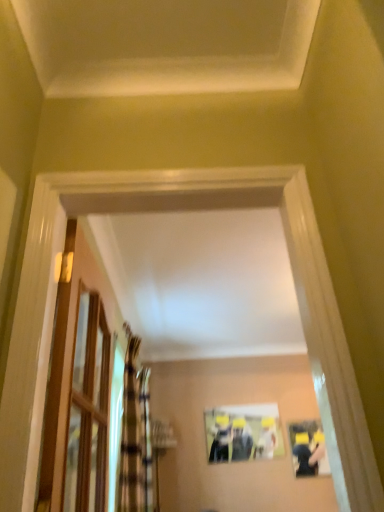
Question: Is plaid fabric curtain at left, the 1th curtain from the back, further to camera compared to gold textured curtain at left, which is the 1th curtain from front to back?

Choices:
 (A) no
 (B) yes

Answer: (B)

Question: Can you confirm if plaid fabric curtain at left, which is the 2th curtain from front to back, is thinner than gold textured curtain at left, arranged as the second curtain when viewed from the back?

Choices:
 (A) yes
 (B) no

Answer: (B)

Question: From the image's perspective, is plaid fabric curtain at left, which is the 2th curtain from front to back, beneath gold textured curtain at left, which is the 1th curtain from front to back?

Choices:
 (A) yes
 (B) no

Answer: (A)

Question: Does plaid fabric curtain at left, which is the 2th curtain from front to back, appear on the left side of gold textured curtain at left, which is the 1th curtain from front to back?

Choices:
 (A) no
 (B) yes

Answer: (B)

Question: Does plaid fabric curtain at left, the 1th curtain from the back, have a greater height compared to gold textured curtain at left, which is the 1th curtain from front to back?

Choices:
 (A) yes
 (B) no

Answer: (A)

Question: From a real-world perspective, relative to matte black couple at center, is clear glass door at left vertically above or below?

Choices:
 (A) above
 (B) below

Answer: (A)

Question: Do you think clear glass door at left is within matte black couple at center, or outside of it?

Choices:
 (A) inside
 (B) outside

Answer: (B)

Question: In the image, is clear glass door at left positioned in front of or behind matte black couple at center?

Choices:
 (A) front
 (B) behind

Answer: (A)

Question: From the image's perspective, is clear glass door at left above or below matte black couple at center?

Choices:
 (A) above
 (B) below

Answer: (A)

Question: From a real-world perspective, is plaid fabric curtain at left, which is the 2th curtain from front to back, positioned above or below matte plastic picture frame at center?

Choices:
 (A) above
 (B) below

Answer: (B)

Question: Considering their positions, is plaid fabric curtain at left, which is the 2th curtain from front to back, located in front of or behind matte plastic picture frame at center?

Choices:
 (A) front
 (B) behind

Answer: (A)

Question: Looking at the image, does plaid fabric curtain at left, which is the 2th curtain from front to back, seem bigger or smaller compared to matte plastic picture frame at center?

Choices:
 (A) big
 (B) small

Answer: (A)

Question: Is plaid fabric curtain at left, which is the 2th curtain from front to back, spatially inside matte plastic picture frame at center, or outside of it?

Choices:
 (A) inside
 (B) outside

Answer: (B)

Question: Relative to clear glass door at left, is gold textured curtain at left, arranged as the second curtain when viewed from the back, in front or behind?

Choices:
 (A) behind
 (B) front

Answer: (A)

Question: Does point (144, 419) appear closer or farther from the camera than point (84, 324)?

Choices:
 (A) farther
 (B) closer

Answer: (A)